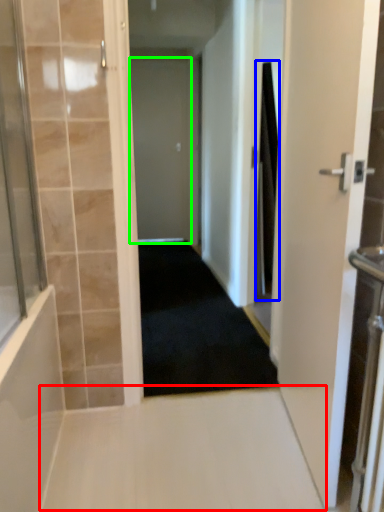
Question: Based on their relative distances, which object is nearer to path (highlighted by a red box)? Choose from shower curtain (highlighted by a blue box) and door (highlighted by a green box).

Choices:
 (A) shower curtain
 (B) door

Answer: (A)